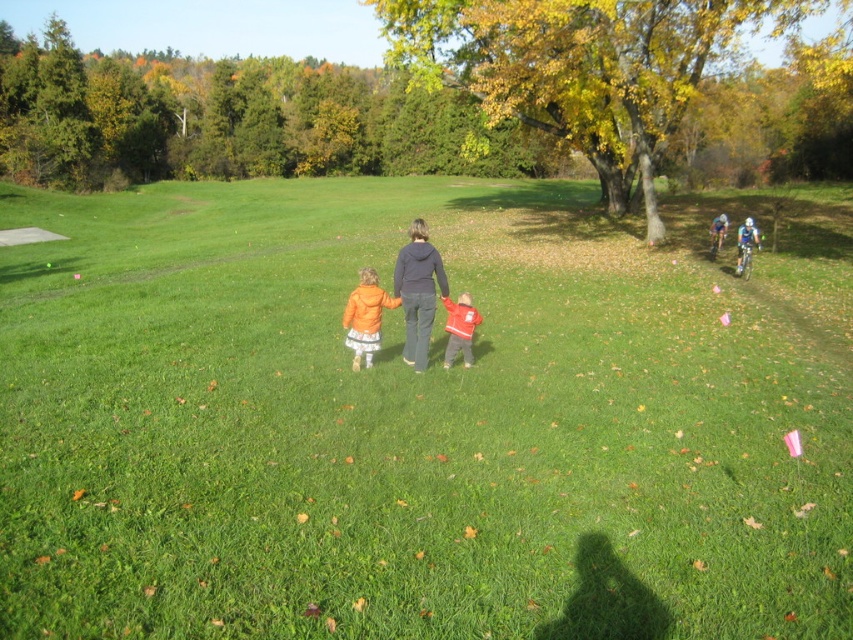
Is red fleece jacket at center taller than blue fabric bicycle at right?

Indeed, red fleece jacket at center has a greater height compared to blue fabric bicycle at right.

Is red fleece jacket at center to the right of blue fabric bicycle at right from the viewer's perspective?

In fact, red fleece jacket at center is to the left of blue fabric bicycle at right.

Between point (463, 320) and point (753, 234), which one is positioned behind?

The point (753, 234) is more distant.

Image resolution: width=853 pixels, height=640 pixels. I want to click on red fleece jacket at center, so click(460, 328).

Which of these two, green grassy field at center or blue fabric cyclist at right, stands shorter?

blue fabric cyclist at right is shorter.

Who is higher up, green grassy field at center or blue fabric cyclist at right?

green grassy field at center is above.

Is point (418, 452) positioned before point (720, 230)?

Yes, it is in front of point (720, 230).

This screenshot has height=640, width=853. Identify the location of green grassy field at center. (421, 419).

Does orange fabric jacket at center have a greater height compared to blue fabric bicycle at right?

Yes.

Which is behind, point (399, 301) or point (749, 253)?

Positioned behind is point (749, 253).

Between point (354, 352) and point (751, 252), which one is positioned behind?

The point (751, 252) is behind.

Identify the location of orange fabric jacket at center. (364, 317).